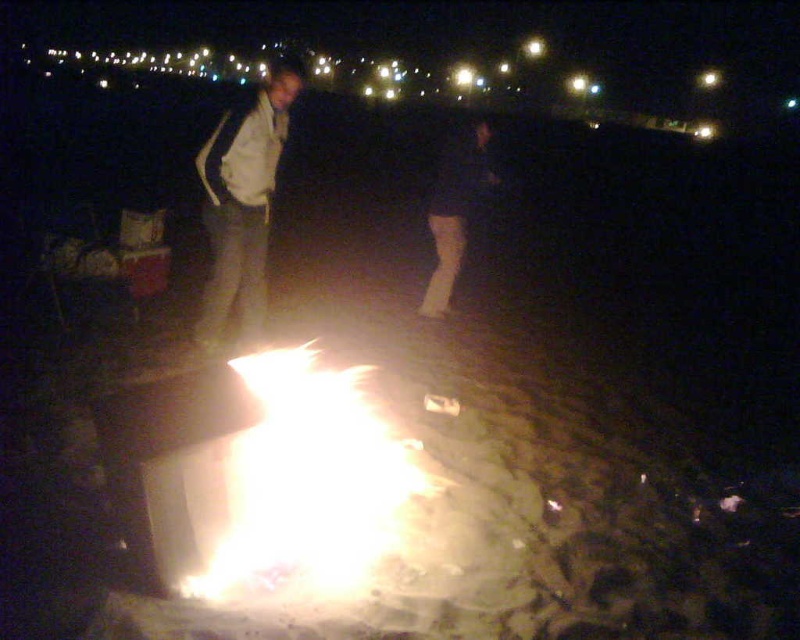
Question: Is flaming wood at center to the left of white matte jacket at center from the viewer's perspective?

Choices:
 (A) yes
 (B) no

Answer: (B)

Question: Which of the following is the closest to the observer?

Choices:
 (A) white matte jacket at center
 (B) dark blue jeans at center

Answer: (A)

Question: Which of these objects is positioned closest to the white matte jacket at center?

Choices:
 (A) dark blue jeans at center
 (B) flaming wood at center

Answer: (B)

Question: Can you confirm if flaming wood at center is bigger than dark blue jeans at center?

Choices:
 (A) yes
 (B) no

Answer: (A)

Question: Which point appears closest to the camera in this image?

Choices:
 (A) (210, 300)
 (B) (244, 557)
 (C) (482, 124)

Answer: (B)

Question: Does flaming wood at center have a larger size compared to dark blue jeans at center?

Choices:
 (A) no
 (B) yes

Answer: (B)